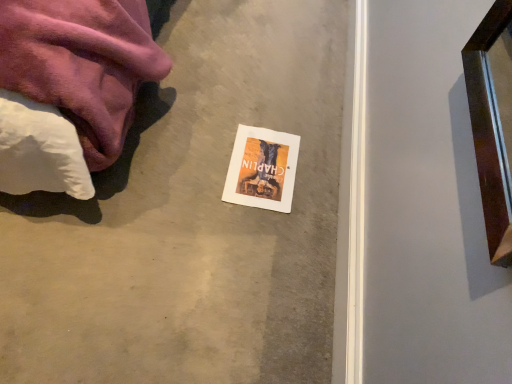
Identify the location of free space on the front side of orange matte paper flyer at center. The image size is (512, 384). (242, 230).